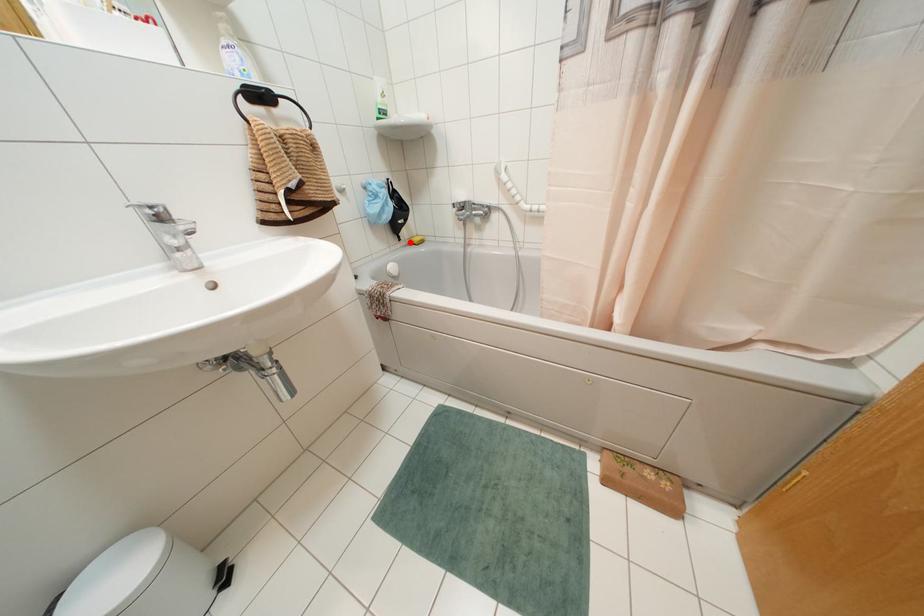
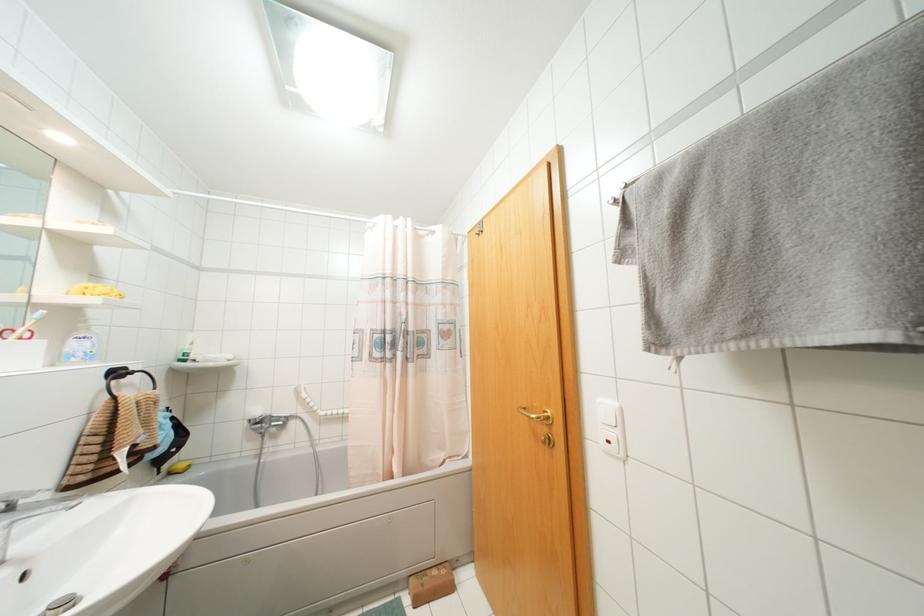
Question: I am providing you with two images of the same scene from different viewpoints. A red point is marked on the first image. Can you still see the location of the red point in image 2?

Choices:
 (A) Yes
 (B) No

Answer: (A)